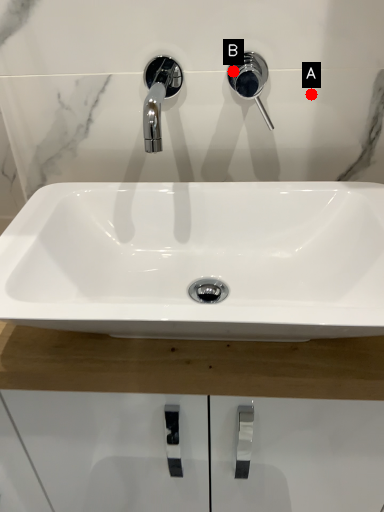
Question: Two points are circled on the image, labeled by A and B beside each circle. Which point is closer to the camera?

Choices:
 (A) A is closer
 (B) B is closer

Answer: (B)